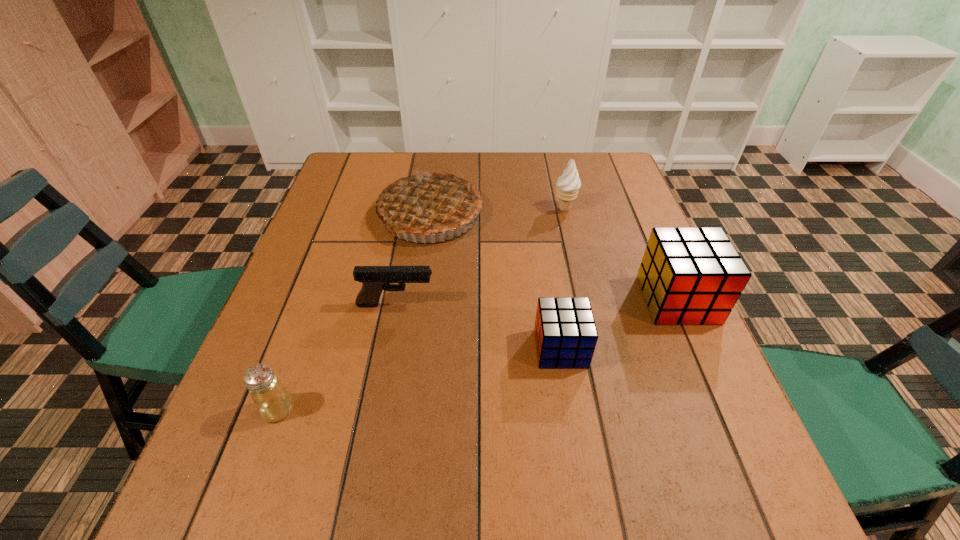
Identify the location of free space between the pie and the shorter cube. (495, 281).

Identify the location of vacant point located between the icecream and the pistol. The width and height of the screenshot is (960, 540). click(x=480, y=257).

Locate an element on the screen. The width and height of the screenshot is (960, 540). empty space that is in between the shorter cube and the leftmost object is located at coordinates (420, 379).

Image resolution: width=960 pixels, height=540 pixels. Identify the location of unoccupied position between the pistol and the saltshaker. (337, 357).

Find the location of a particular element. vacant space that is in between the nearest object and the pistol is located at coordinates (337, 357).

You are a GUI agent. You are given a task and a screenshot of the screen. Output one action in this format:
    pyautogui.click(x=<x>, y=<y>)
    Task: Click on the empty space between the rightmost object and the pie
    The image size is (960, 540).
    Given the screenshot: What is the action you would take?
    pyautogui.click(x=554, y=257)

Find the location of a particular element. The height and width of the screenshot is (540, 960). vacant area that lies between the right cube and the icecream is located at coordinates (621, 254).

Locate which object ranks in proximity to the pistol. Please provide its 2D coordinates. Your answer should be formatted as a tuple, i.e. [(x, y)], where the tuple contains the x and y coordinates of a point satisfying the conditions above.

[(431, 201)]

Where is `object that is the third closest one to the pistol`? object that is the third closest one to the pistol is located at coordinates (273, 402).

I want to click on vacant region that satisfies the following two spatial constraints: 1. on the front-facing side of the icecream; 2. on the back side of the taller cube, so click(586, 300).